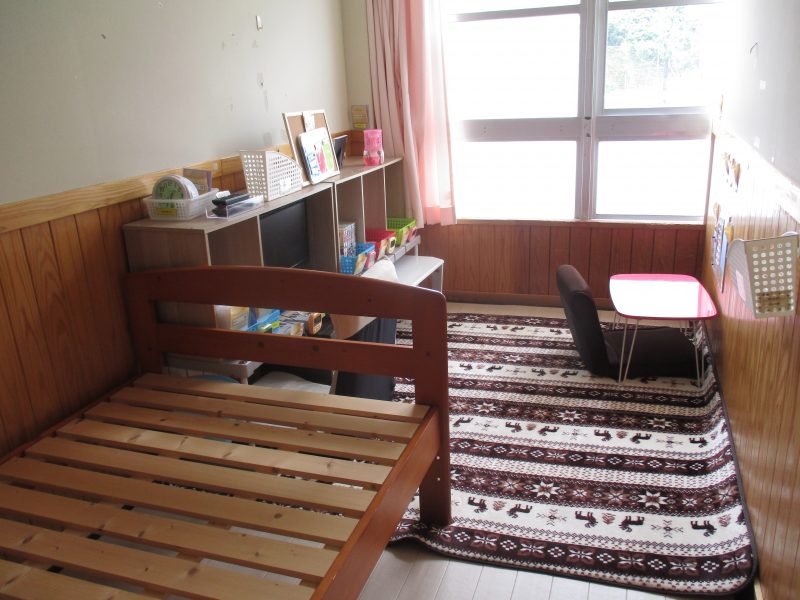
Locate an element on the screen. chair is located at coordinates (588, 329).